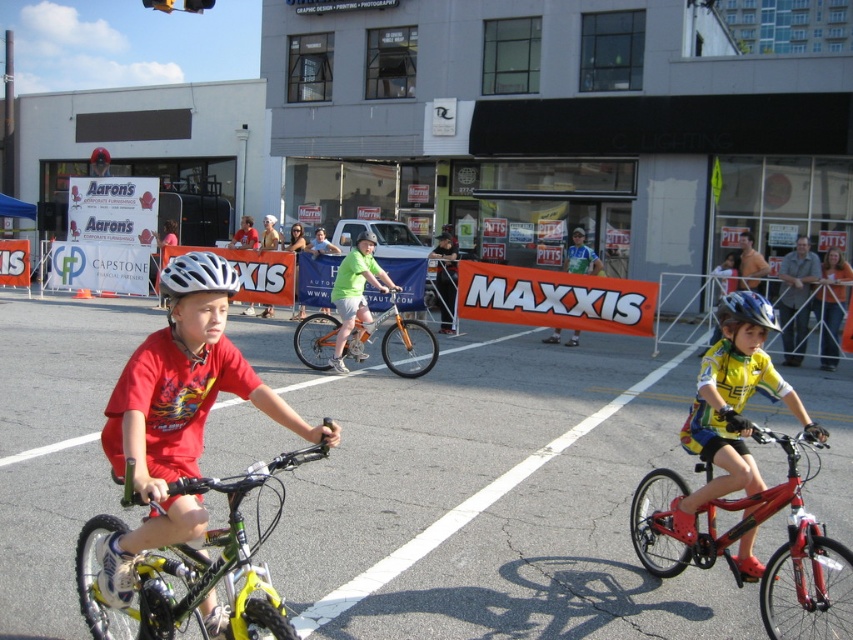
Question: Does orange matte bicycle at center appear on the left side of blue matte bicycle helmet at center?

Choices:
 (A) no
 (B) yes

Answer: (B)

Question: Which point is closer to the camera?

Choices:
 (A) orange matte bicycle at center
 (B) yellow-green matte bicycle at center
 (C) white matte bicycle helmet at center

Answer: (B)

Question: Which point is farther to the camera?

Choices:
 (A) blue matte bicycle helmet at center
 (B) yellow jersey cyclist at center

Answer: (B)

Question: Does shiny red bicycle at center appear on the right side of blue matte bicycle helmet at center?

Choices:
 (A) yes
 (B) no

Answer: (B)

Question: Estimate the real-world distances between objects in this image. Which object is farther from the white matte bicycle helmet at center?

Choices:
 (A) orange matte bicycle at center
 (B) white matte helmet at center
 (C) orange fabric banner at center

Answer: (C)

Question: Is the position of shiny red bicycle at center more distant than that of yellow jersey cyclist at center?

Choices:
 (A) no
 (B) yes

Answer: (A)